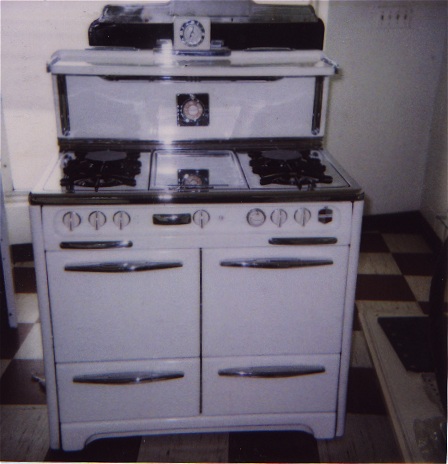
Find the location of a particular element. The image size is (448, 464). first light switch is located at coordinates (382, 18).